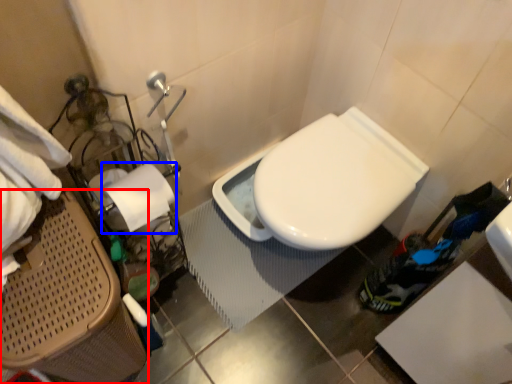
Question: Which of the following is the closest to the observer, laundry basket (highlighted by a red box) or toilet paper (highlighted by a blue box)?

Choices:
 (A) laundry basket
 (B) toilet paper

Answer: (A)